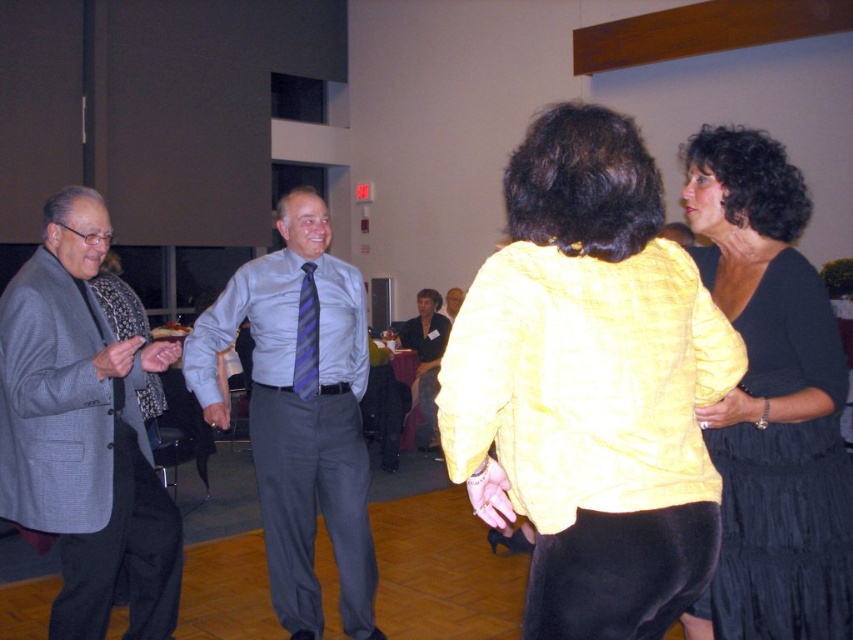
Who is more forward, (83, 269) or (808, 349)?

Point (808, 349)

The width and height of the screenshot is (853, 640). I want to click on gray textured blazer at left, so [x=83, y=433].

Between point (357, 432) and point (763, 337), which one is positioned in front?

Positioned in front is point (763, 337).

Who is more distant from viewer, (x=289, y=420) or (x=804, y=588)?

Positioned behind is point (x=289, y=420).

Locate an element on the screen. This screenshot has width=853, height=640. light blue shirt at center is located at coordinates (300, 417).

Measure the distance from light blue shirt at center to purple striped tie at center.

The distance of light blue shirt at center from purple striped tie at center is 23.62 centimeters.

Who is taller, light blue shirt at center or purple striped tie at center?

light blue shirt at center

Locate an element on the screen. This screenshot has width=853, height=640. light blue shirt at center is located at coordinates (300, 417).